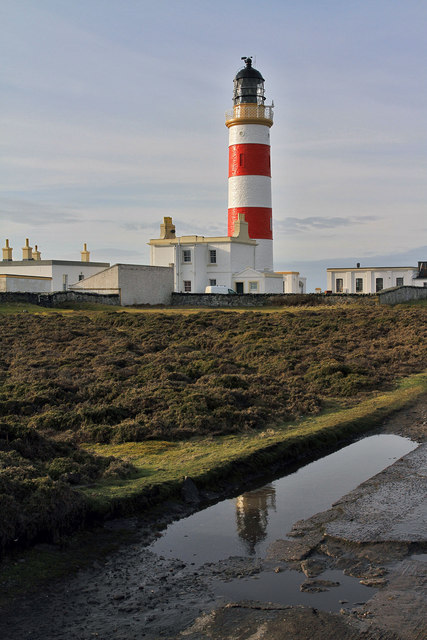
Where is `window`? window is located at coordinates (213, 259).